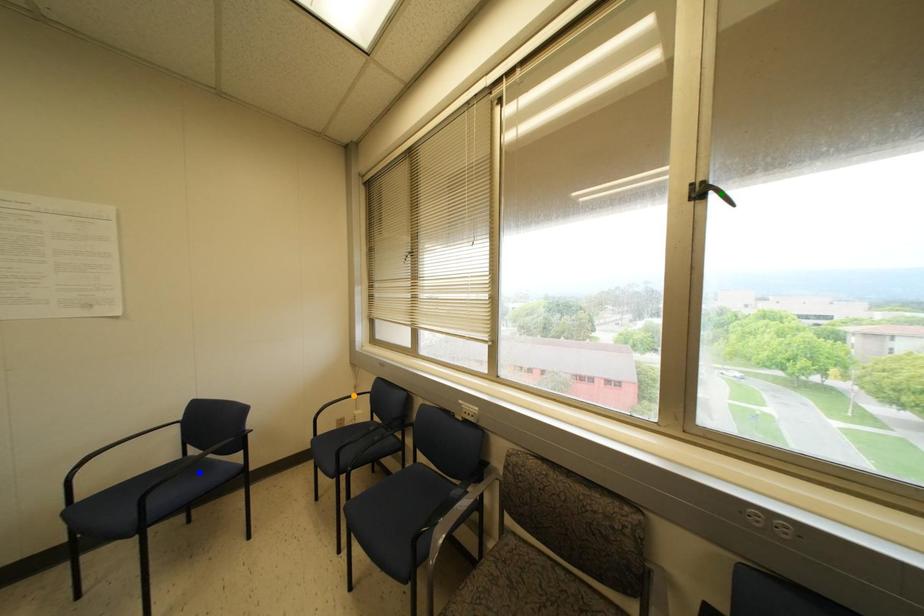
Order these from nearest to farthest:
1. blue point
2. orange point
3. green point

green point
blue point
orange point